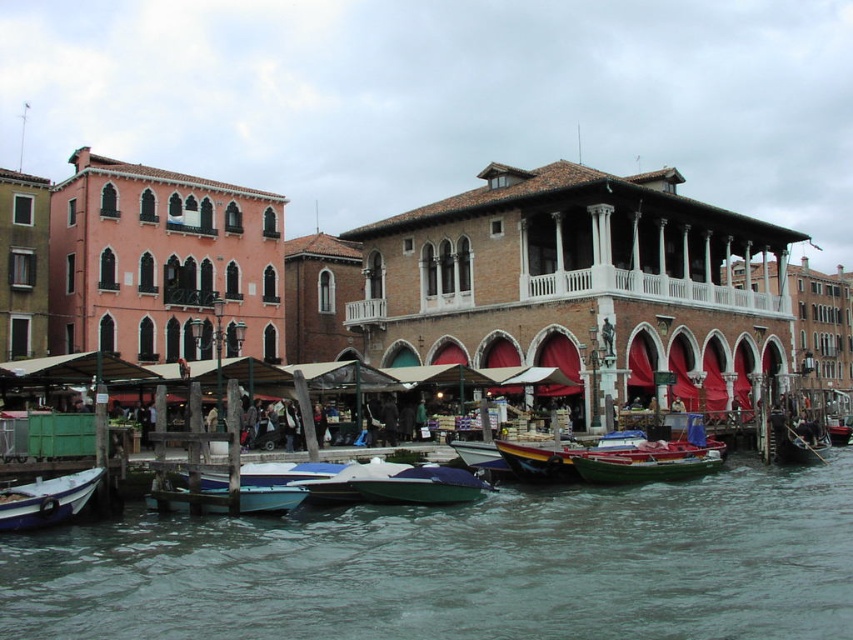
Question: Estimate the real-world distances between objects in this image. Which object is farther from the white wooden boat at lower left?

Choices:
 (A) green water at lower center
 (B) shiny blue boat at center
 (C) green matte boat at lower left

Answer: (B)

Question: From the image, what is the correct spatial relationship of shiny blue boat at center in relation to metallic green boat at center?

Choices:
 (A) above
 (B) below

Answer: (B)

Question: Which point is closer to the camera?

Choices:
 (A) white wooden boat at lower left
 (B) shiny blue boat at center
 (C) green water at lower center

Answer: (C)

Question: Can you confirm if shiny blue boat at center is positioned above metallic green boat at center?

Choices:
 (A) no
 (B) yes

Answer: (A)

Question: Which is farther from the shiny blue boat at center?

Choices:
 (A) white wooden boat at lower left
 (B) green matte boat at lower left
 (C) green water at lower center

Answer: (A)

Question: Does green water at lower center have a greater width compared to green matte boat at lower left?

Choices:
 (A) no
 (B) yes

Answer: (B)